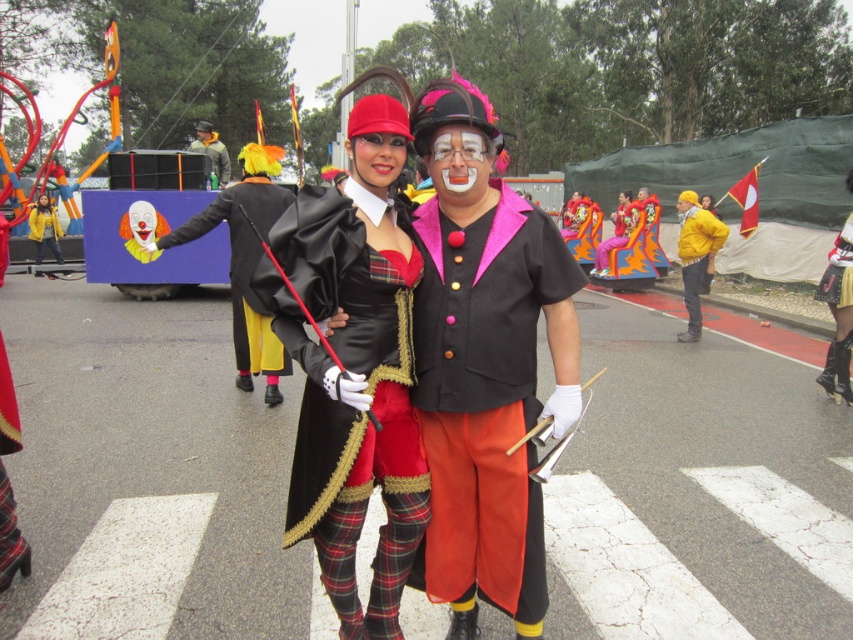
Question: Which is nearer to the brushed metal helmet at upper center?

Choices:
 (A) matte yellow clown nose at center
 (B) black satin cape at center
 (C) matte yellow clown mask at center

Answer: (B)

Question: Is satin black coat at center bigger than matte black hat at center?

Choices:
 (A) no
 (B) yes

Answer: (B)

Question: Observing the image, what is the correct spatial positioning of matte clown face at center in reference to velvet black cape at center?

Choices:
 (A) above
 (B) below

Answer: (B)

Question: Is satin black coat at center behind matte clown face at center?

Choices:
 (A) no
 (B) yes

Answer: (A)

Question: Which of the following is the farthest from the observer?

Choices:
 (A) (221, 145)
 (B) (822, 292)

Answer: (A)

Question: Which of the following is the farthest from the observer?

Choices:
 (A) matte black hat at center
 (B) black satin cape at center
 (C) yellow matte jacket at center

Answer: (C)